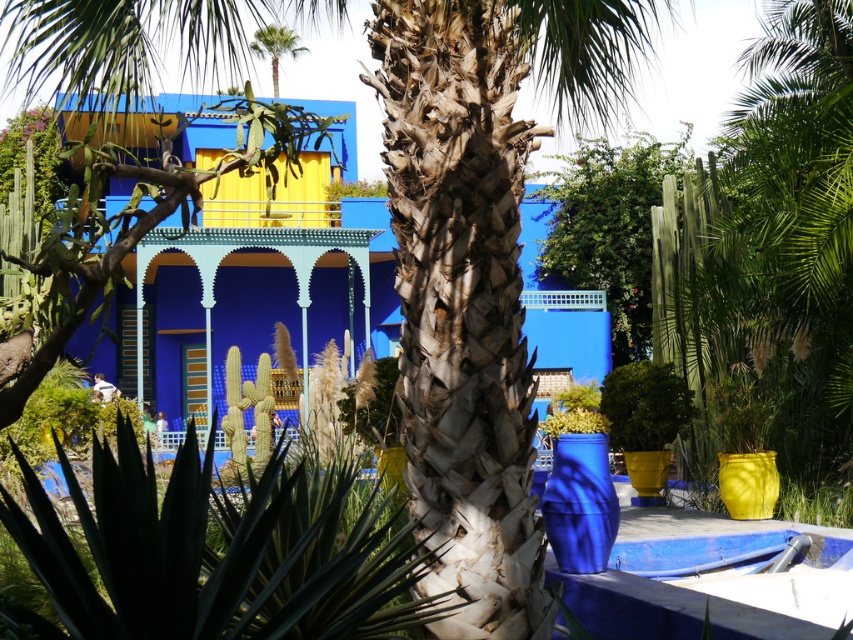
Question: Which of the following is the farthest from the observer?

Choices:
 (A) leathery brown palm trunk at center
 (B) green leafy palm tree at upper center
 (C) blue glossy building at center

Answer: (B)

Question: Can you confirm if blue glossy building at center is wider than green leafy palm tree at upper center?

Choices:
 (A) no
 (B) yes

Answer: (B)

Question: Does blue glossy building at center have a larger size compared to green leafy palm tree at upper center?

Choices:
 (A) yes
 (B) no

Answer: (A)

Question: Can you confirm if leathery brown palm trunk at center is bigger than blue glossy building at center?

Choices:
 (A) yes
 (B) no

Answer: (B)

Question: Which point is closer to the camera?

Choices:
 (A) (259, 33)
 (B) (375, 339)

Answer: (B)

Question: Which point is farther to the camera?

Choices:
 (A) blue glossy building at center
 (B) green leafy palm tree at upper center

Answer: (B)